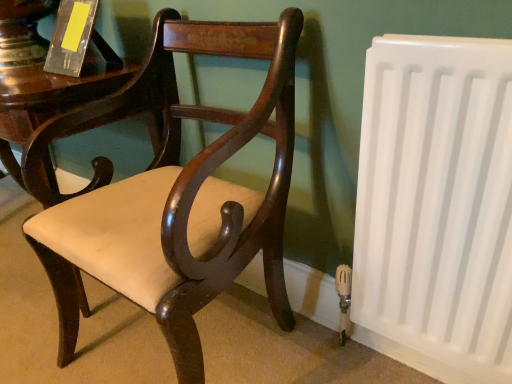
This screenshot has width=512, height=384. What do you see at coordinates (437, 202) in the screenshot?
I see `white plastic radiator at right` at bounding box center [437, 202].

From the picture: In order to face matte wood chair at center, should I rotate leftwards or rightwards?

Turn left by 11.528 degrees to look at matte wood chair at center.

The image size is (512, 384). What do you see at coordinates (173, 196) in the screenshot?
I see `matte wood chair at center` at bounding box center [173, 196].

Identify the location of white plastic radiator at right. (437, 202).

Which object is more forward, matte wood chair at center or translucent acrylic book at upper left?

matte wood chair at center is more forward.

Which is in front, point (88, 248) or point (69, 33)?

The point (88, 248) is more forward.

Can you confirm if matte wood chair at center is taller than translucent acrylic book at upper left?

Yes, matte wood chair at center is taller than translucent acrylic book at upper left.

Is matte wood chair at center to the left of translucent acrylic book at upper left from the viewer's perspective?

Incorrect, matte wood chair at center is not on the left side of translucent acrylic book at upper left.

Are white plastic radiator at right and translucent acrylic book at upper left making contact?

white plastic radiator at right and translucent acrylic book at upper left are not in contact.

I want to click on radiator below the translucent acrylic book at upper left (from a real-world perspective), so click(x=437, y=202).

Can you confirm if white plastic radiator at right is shorter than translucent acrylic book at upper left?

In fact, white plastic radiator at right may be taller than translucent acrylic book at upper left.

From the picture: Could you tell me if white plastic radiator at right is turned towards translucent acrylic book at upper left?

No, white plastic radiator at right does not turn towards translucent acrylic book at upper left.

I want to click on chair on the right of the translucent acrylic book at upper left, so click(x=173, y=196).

Looking at the image, does translucent acrylic book at upper left seem bigger or smaller compared to matte wood chair at center?

In the image, translucent acrylic book at upper left appears to be smaller than matte wood chair at center.

Based on the photo, from a real-world perspective, does translucent acrylic book at upper left stand above matte wood chair at center?

Indeed, from a real-world perspective, translucent acrylic book at upper left stands above matte wood chair at center.

Consider the image. Who is shorter, matte wood chair at center or white plastic radiator at right?

white plastic radiator at right is shorter.

Is matte wood chair at center outside of white plastic radiator at right?

matte wood chair at center lies outside white plastic radiator at right's area.

Which is behind, matte wood chair at center or white plastic radiator at right?

white plastic radiator at right is further from the camera.

In the scene shown: From the image's perspective, does translucent acrylic book at upper left appear higher than white plastic radiator at right?

Correct, translucent acrylic book at upper left appears higher than white plastic radiator at right in the image.

Is translucent acrylic book at upper left oriented away from white plastic radiator at right?

No, translucent acrylic book at upper left is not facing the opposite direction of white plastic radiator at right.

Who is taller, translucent acrylic book at upper left or white plastic radiator at right?

Standing taller between the two is white plastic radiator at right.

Based on the photo, from a real-world perspective, is translucent acrylic book at upper left located higher than white plastic radiator at right?

Correct, in the physical world, translucent acrylic book at upper left is higher than white plastic radiator at right.

What are the coordinates of `radiator below the matte wood chair at center (from a real-world perspective)` in the screenshot? It's located at (437, 202).

Considering the positions of objects white plastic radiator at right and matte wood chair at center in the image provided, who is more to the right, white plastic radiator at right or matte wood chair at center?

From the viewer's perspective, white plastic radiator at right appears more on the right side.

From the image's perspective, does white plastic radiator at right appear lower than matte wood chair at center?

Yes, from the image's perspective, white plastic radiator at right is beneath matte wood chair at center.

Find the location of `paperback book to the left of matte wood chair at center`. paperback book to the left of matte wood chair at center is located at coordinates (71, 37).

At what (x,y) coordinates should I click in order to perform the action: click on paperback book above the white plastic radiator at right (from a real-world perspective). Please return your answer as a coordinate pair (x, y). The width and height of the screenshot is (512, 384). Looking at the image, I should click on pyautogui.click(x=71, y=37).

Estimate the real-world distances between objects in this image. Which object is further from white plastic radiator at right, translucent acrylic book at upper left or matte wood chair at center?

translucent acrylic book at upper left lies further to white plastic radiator at right than the other object.

Estimate the real-world distances between objects in this image. Which object is further from translucent acrylic book at upper left, white plastic radiator at right or matte wood chair at center?

white plastic radiator at right is further to translucent acrylic book at upper left.

Based on their spatial positions, is white plastic radiator at right or translucent acrylic book at upper left further from matte wood chair at center?

translucent acrylic book at upper left is positioned further to the anchor matte wood chair at center.

Looking at the image, which one is located further to white plastic radiator at right, matte wood chair at center or translucent acrylic book at upper left?

translucent acrylic book at upper left is further to white plastic radiator at right.

Based on the photo, based on their spatial positions, is translucent acrylic book at upper left or white plastic radiator at right closer to matte wood chair at center?

Based on the image, white plastic radiator at right appears to be nearer to matte wood chair at center.

Based on the photo, looking at the image, which one is located further to translucent acrylic book at upper left, matte wood chair at center or white plastic radiator at right?

white plastic radiator at right is further to translucent acrylic book at upper left.

This screenshot has height=384, width=512. I want to click on chair between translucent acrylic book at upper left and white plastic radiator at right from left to right, so click(173, 196).